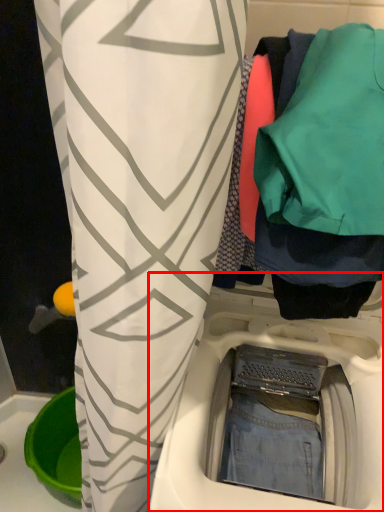
Question: From the image's perspective, what is the correct spatial positioning of washing machine (annotated by the red box) in reference to closet?

Choices:
 (A) above
 (B) below

Answer: (B)